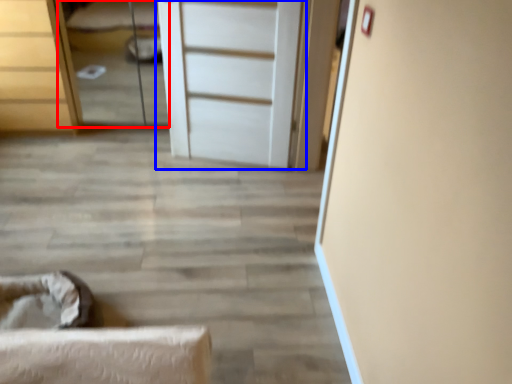
Question: Which object is closer to the camera taking this photo, bed (highlighted by a red box) or door (highlighted by a blue box)?

Choices:
 (A) bed
 (B) door

Answer: (B)